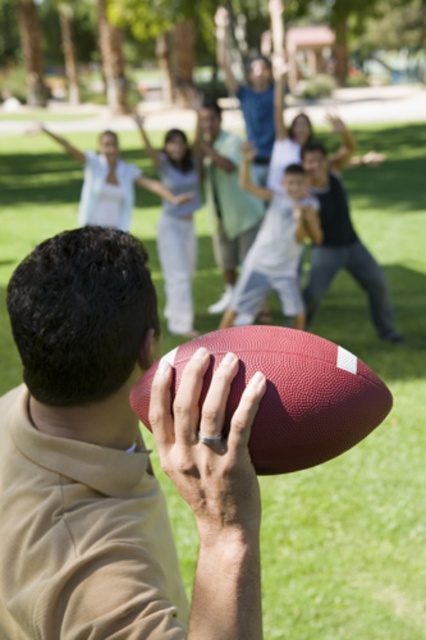
Question: Which point appears farthest from the camera in this image?

Choices:
 (A) (233, 211)
 (B) (213, 522)
 (C) (328, 394)

Answer: (A)

Question: Does matte black shirt at center lie in front of light blue shirt at center?

Choices:
 (A) no
 (B) yes

Answer: (B)

Question: Is leather textured football at center above matte black shirt at center?

Choices:
 (A) yes
 (B) no

Answer: (B)

Question: Which point is closer to the camera?

Choices:
 (A) (273, 412)
 (B) (187, 198)
 (C) (247, 195)

Answer: (A)

Question: Which point is closer to the camera taking this photo?

Choices:
 (A) (117, 186)
 (B) (264, 428)
 (C) (221, 186)

Answer: (B)

Question: Can you confirm if matte black shirt at center is thinner than light blue shirt at center?

Choices:
 (A) yes
 (B) no

Answer: (B)